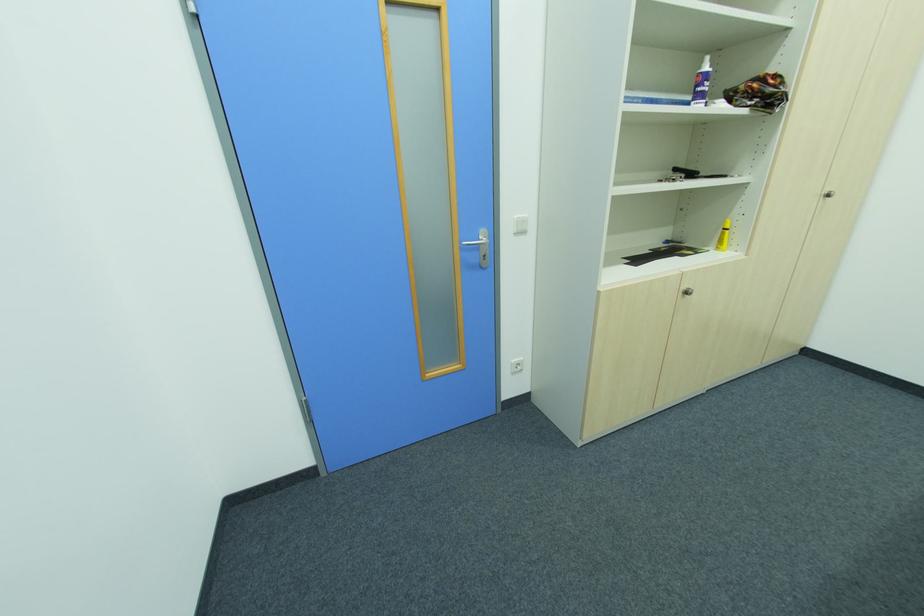
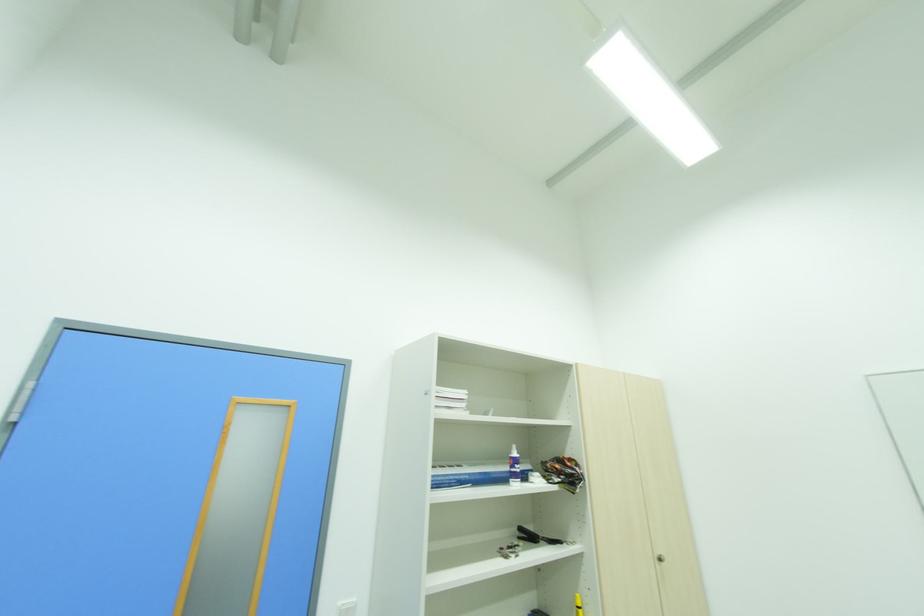
Locate, in the second image, the point that corresponds to [694,175] in the first image.

(536, 539)